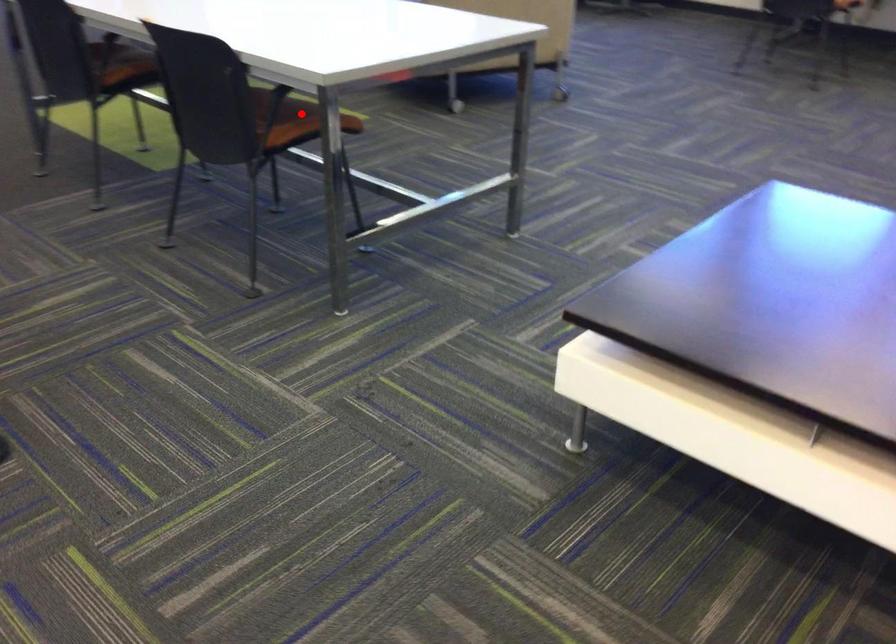
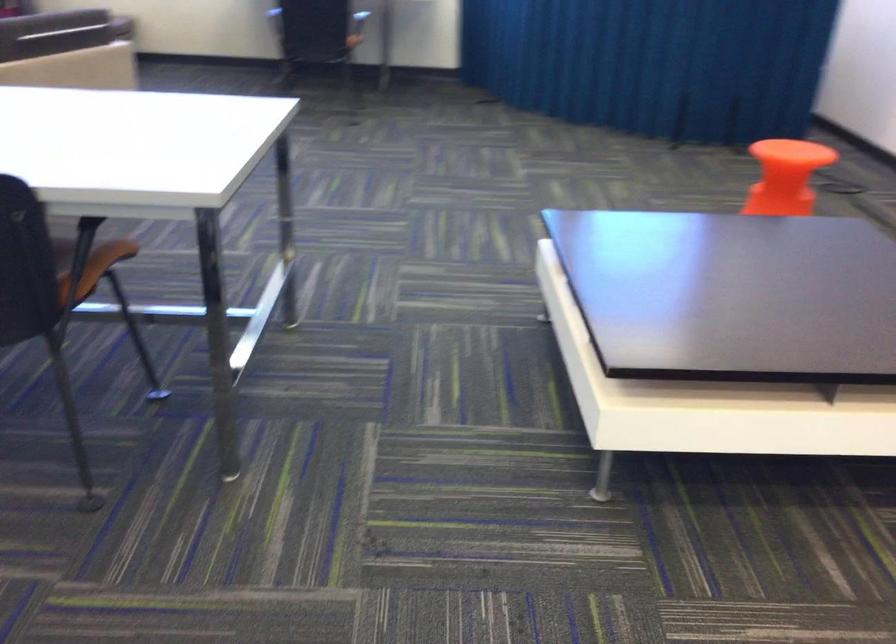
Question: I am providing you with two images of the same scene from different viewpoints. A red point is shown in image1. For the corresponding object point in image2, is it positioned nearer or farther from the camera?

Choices:
 (A) Nearer
 (B) Farther

Answer: (A)